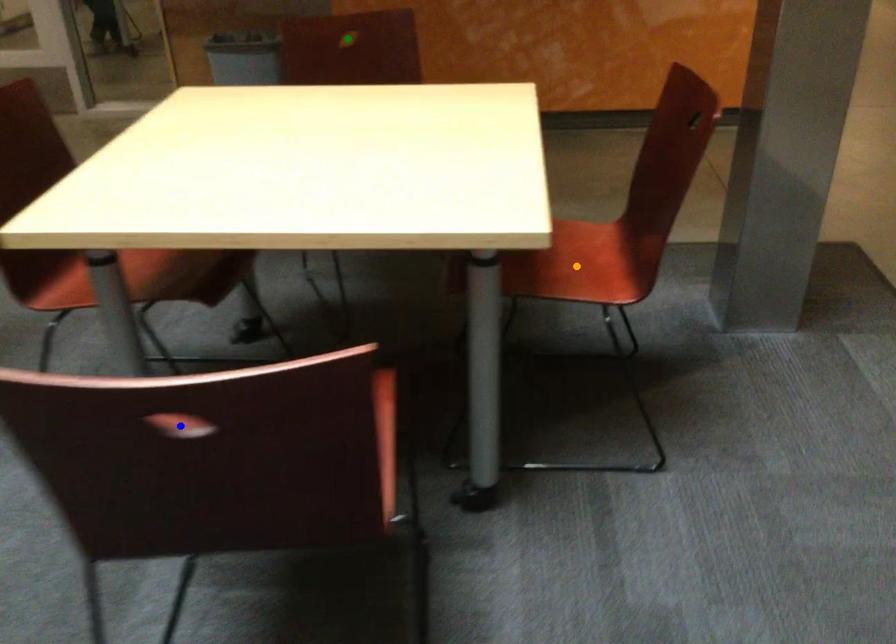
Order these from nearest to farthest:
1. green point
2. orange point
3. blue point

1. green point
2. orange point
3. blue point